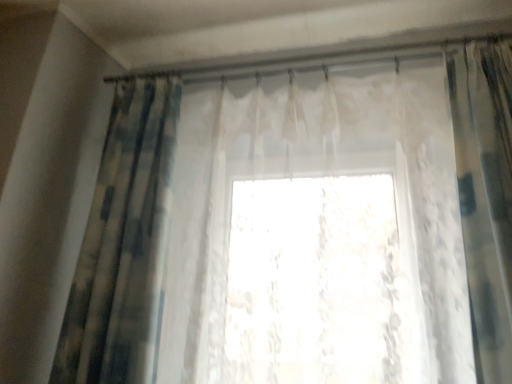
At what (x,y) coordinates should I click in order to perform the action: click on blue-gray textured curtains at upper center. Please return your answer as a coordinate pair (x, y). Looking at the image, I should click on (124, 245).

Measure the distance between point (154, 174) and camera.

Point (154, 174) and camera are 4.21 feet apart.

Describe the element at coordinates (124, 245) in the screenshot. Image resolution: width=512 pixels, height=384 pixels. I see `blue-gray textured curtains at upper center` at that location.

You are a GUI agent. You are given a task and a screenshot of the screen. Output one action in this format:
    pyautogui.click(x=<x>, y=<y>)
    Task: Click on the blue-gray textured curtains at upper center
    The height and width of the screenshot is (384, 512).
    Given the screenshot: What is the action you would take?
    pyautogui.click(x=124, y=245)